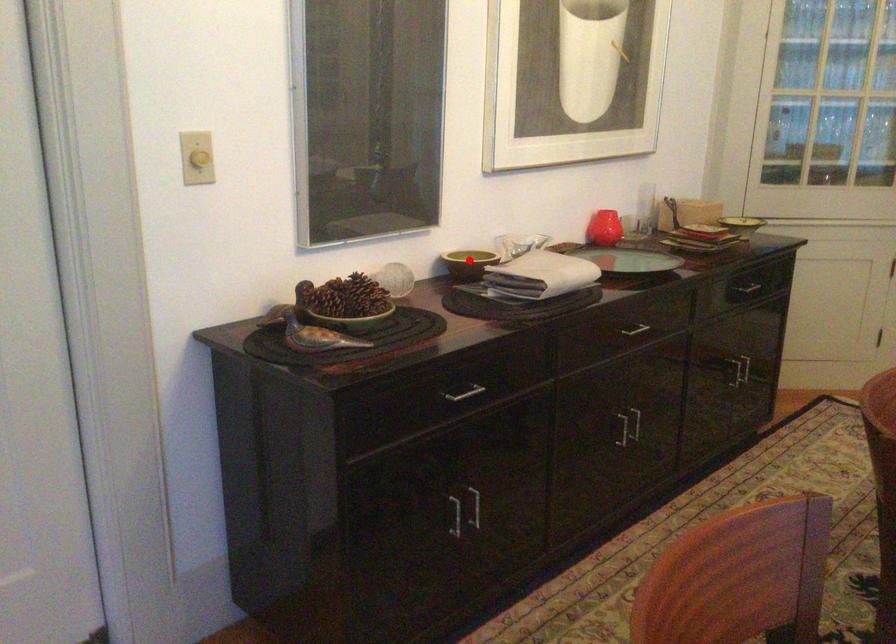
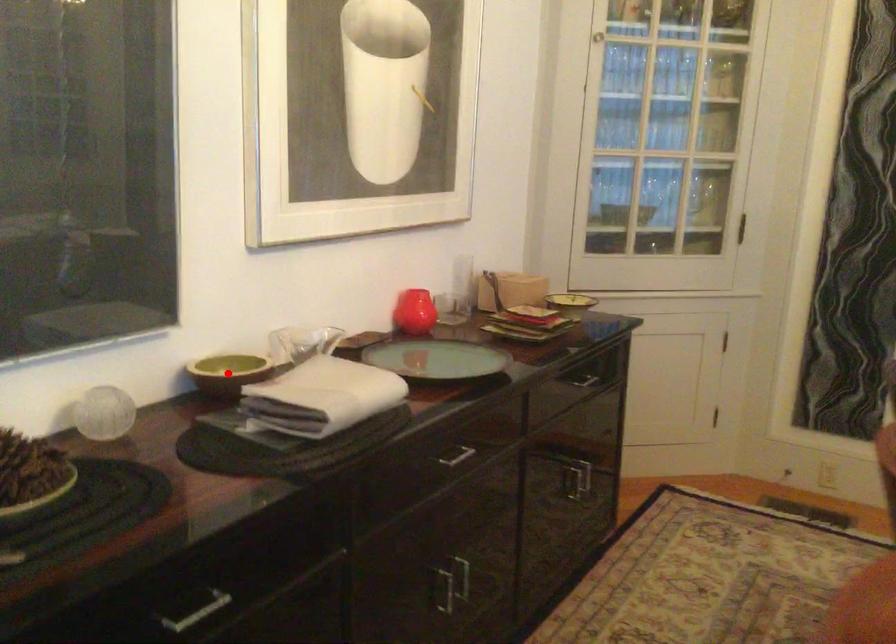
I am providing you with two images of the same scene from different viewpoints. A red point is marked on the first image and another point is marked on the second image. Are the points marked in image1 and image2 representing the same 3D position?

Yes